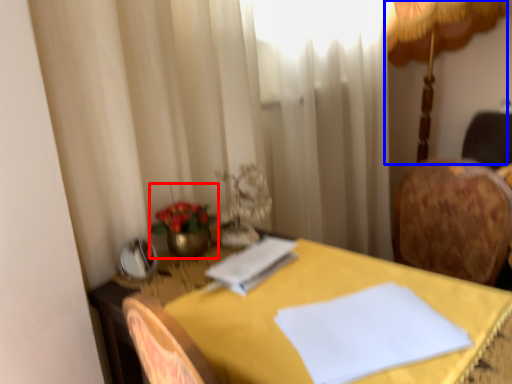
Question: Which of the following is the closest to the observer, floral arrangement (highlighted by a red box) or table lamp (highlighted by a blue box)?

Choices:
 (A) floral arrangement
 (B) table lamp

Answer: (A)